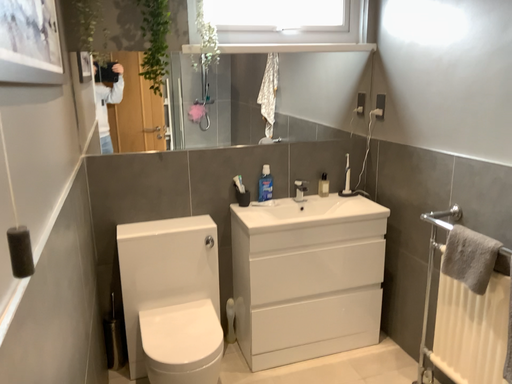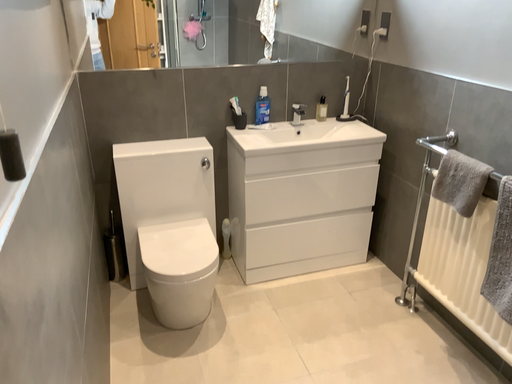
Question: How did the camera likely rotate when shooting the video?

Choices:
 (A) rotated downward
 (B) rotated upward

Answer: (A)